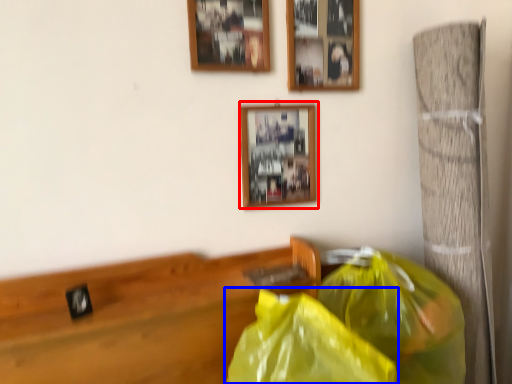
Question: Among these objects, which one is nearest to the camera, picture frame (highlighted by a red box) or plastic bag (highlighted by a blue box)?

Choices:
 (A) picture frame
 (B) plastic bag

Answer: (B)